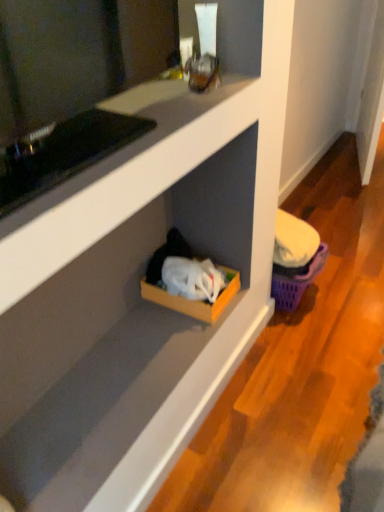
Find the location of a particular element. vacant space to the left of wooden cardboard box at lower center is located at coordinates (134, 323).